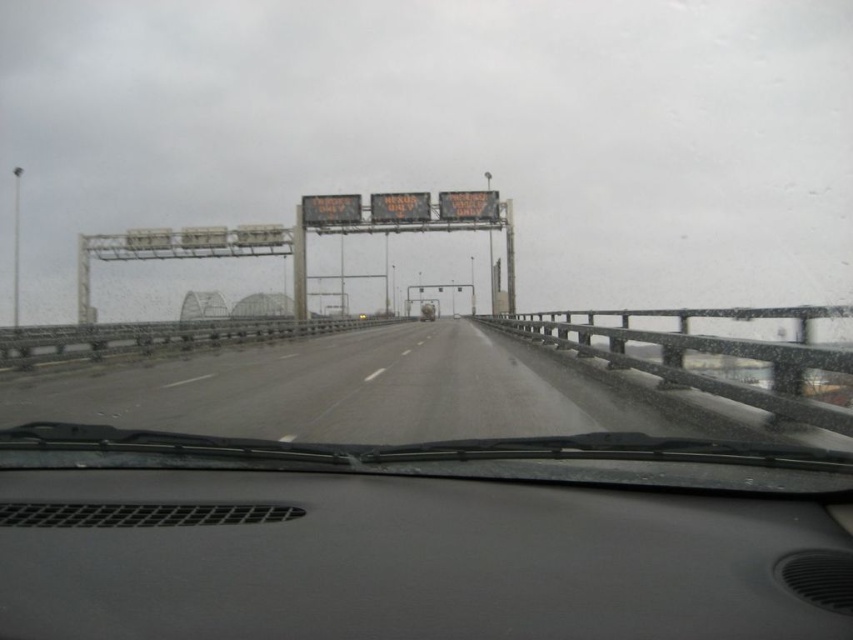
How far apart are gray matte dashboard at center and smooth asphalt highway at center?

gray matte dashboard at center and smooth asphalt highway at center are 23.99 meters apart.

Is the position of gray matte dashboard at center less distant than that of smooth asphalt highway at center?

Yes, gray matte dashboard at center is closer to the viewer.

Is point (662, 605) behind point (611, 376)?

No, it is in front of (611, 376).

Locate an element on the screen. This screenshot has width=853, height=640. gray matte dashboard at center is located at coordinates (408, 560).